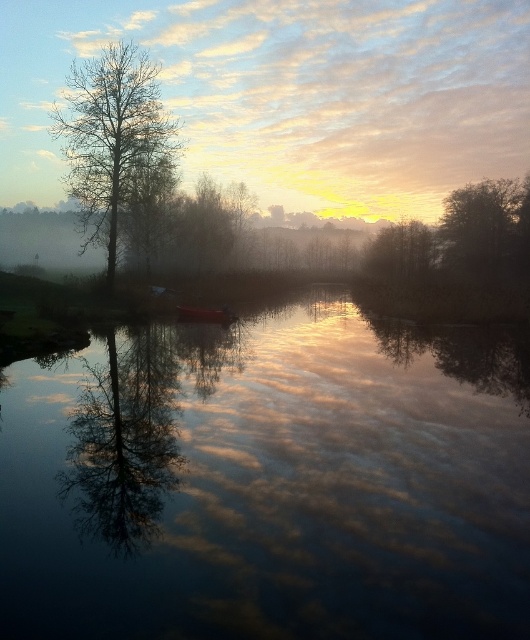
Question: Which point appears farthest from the camera in this image?

Choices:
 (A) click(x=139, y=141)
 (B) click(x=183, y=148)
 (C) click(x=184, y=316)

Answer: (B)

Question: Estimate the real-world distances between objects in this image. Which object is closer to the smooth water at center?

Choices:
 (A) smooth tree at left
 (B) bare branches tree at left
 (C) metallic red boat at center

Answer: (C)

Question: Is bare branches tree at left above metallic red boat at center?

Choices:
 (A) no
 (B) yes

Answer: (B)

Question: Where is smooth tree at left located in relation to metallic red boat at center in the image?

Choices:
 (A) left
 (B) right

Answer: (B)

Question: Can you confirm if smooth water at center is positioned to the right of smooth tree at left?

Choices:
 (A) no
 (B) yes

Answer: (A)

Question: Among these objects, which one is farthest from the camera?

Choices:
 (A) bare branches tree at left
 (B) smooth tree at left
 (C) metallic red boat at center

Answer: (B)